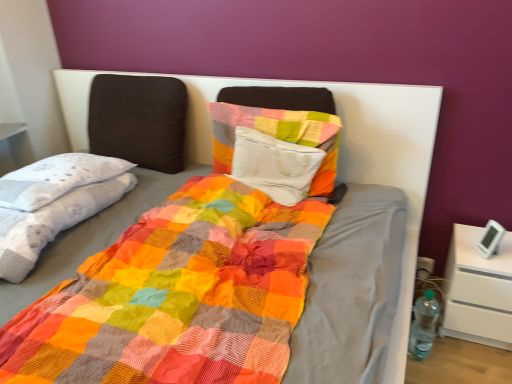
Question: Are multicolored patchwork blanket at left and clear plastic bottle at right located far from each other?

Choices:
 (A) yes
 (B) no

Answer: (A)

Question: Considering the relative sizes of multicolored patchwork blanket at left and clear plastic bottle at right in the image provided, is multicolored patchwork blanket at left bigger than clear plastic bottle at right?

Choices:
 (A) yes
 (B) no

Answer: (A)

Question: Is multicolored patchwork blanket at left taller than clear plastic bottle at right?

Choices:
 (A) yes
 (B) no

Answer: (B)

Question: Is multicolored patchwork blanket at left further to the viewer compared to clear plastic bottle at right?

Choices:
 (A) yes
 (B) no

Answer: (B)

Question: Considering the relative sizes of multicolored patchwork blanket at left and clear plastic bottle at right in the image provided, is multicolored patchwork blanket at left smaller than clear plastic bottle at right?

Choices:
 (A) no
 (B) yes

Answer: (A)

Question: Is multicolored patchwork blanket at left at the left side of clear plastic bottle at right?

Choices:
 (A) no
 (B) yes

Answer: (B)

Question: Is clear plastic bottle at right at the right side of textured cotton pillow at center?

Choices:
 (A) no
 (B) yes

Answer: (B)

Question: Can you confirm if clear plastic bottle at right is taller than textured cotton pillow at center?

Choices:
 (A) no
 (B) yes

Answer: (A)

Question: Is clear plastic bottle at right oriented away from textured cotton pillow at center?

Choices:
 (A) yes
 (B) no

Answer: (B)

Question: Does clear plastic bottle at right have a larger size compared to textured cotton pillow at center?

Choices:
 (A) no
 (B) yes

Answer: (A)

Question: Is clear plastic bottle at right outside of textured cotton pillow at center?

Choices:
 (A) yes
 (B) no

Answer: (A)

Question: Does clear plastic bottle at right appear on the left side of textured cotton pillow at center?

Choices:
 (A) no
 (B) yes

Answer: (A)

Question: From the image's perspective, is textured cotton pillow at center above multicolored patchwork blanket at left?

Choices:
 (A) no
 (B) yes

Answer: (B)